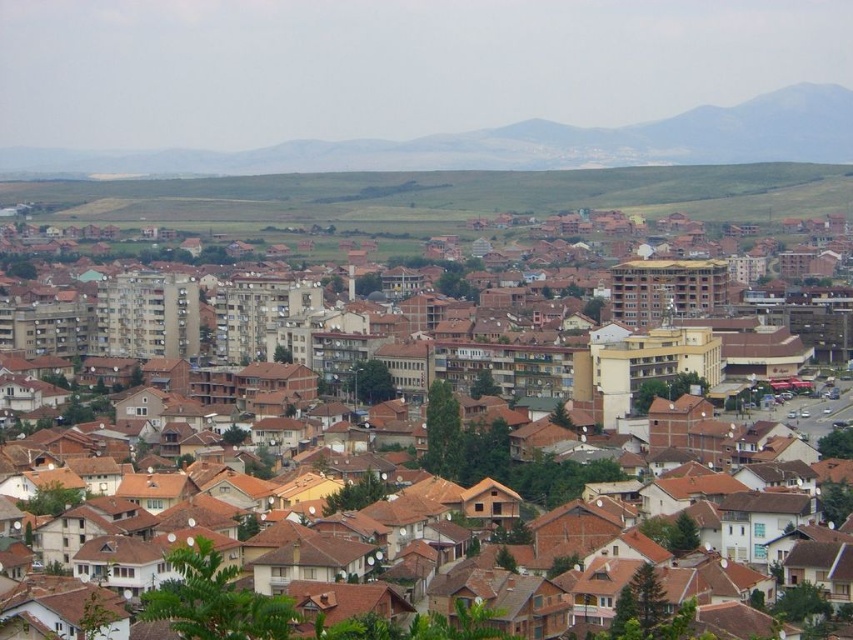
Question: Which of the following is the farthest from the observer?

Choices:
 (A) (204, 189)
 (B) (399, 362)

Answer: (A)

Question: Does brown brick buildings at center have a lesser width compared to green grassland at center?

Choices:
 (A) yes
 (B) no

Answer: (A)

Question: Which point is closer to the camera taking this photo?

Choices:
 (A) (271, 200)
 (B) (521, 486)

Answer: (B)

Question: Which object is farther from the camera taking this photo?

Choices:
 (A) green grassland at center
 (B) brown brick buildings at center

Answer: (A)

Question: Is brown brick buildings at center to the left of green grassland at center from the viewer's perspective?

Choices:
 (A) yes
 (B) no

Answer: (A)

Question: Is brown brick buildings at center positioned at the back of green grassland at center?

Choices:
 (A) no
 (B) yes

Answer: (A)